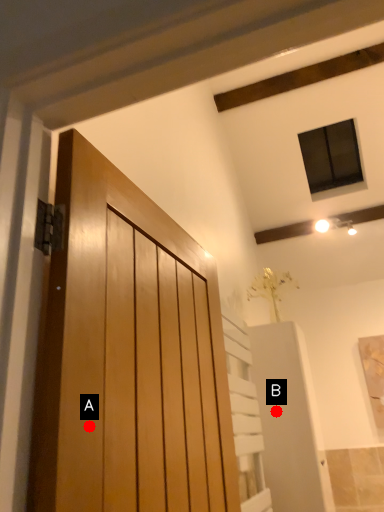
Question: Two points are circled on the image, labeled by A and B beside each circle. Which point is closer to the camera taking this photo?

Choices:
 (A) A is closer
 (B) B is closer

Answer: (A)